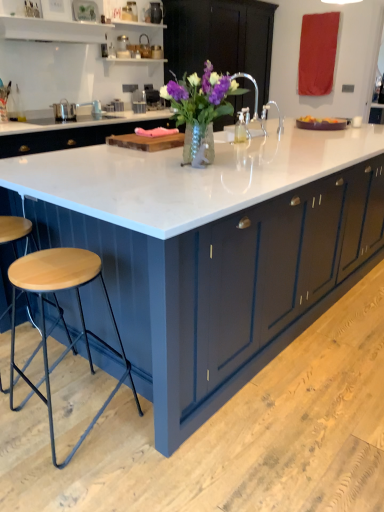
Where is `vacant space positioned to the left of translucent glass vase with purple flowers at center`? vacant space positioned to the left of translucent glass vase with purple flowers at center is located at coordinates (116, 166).